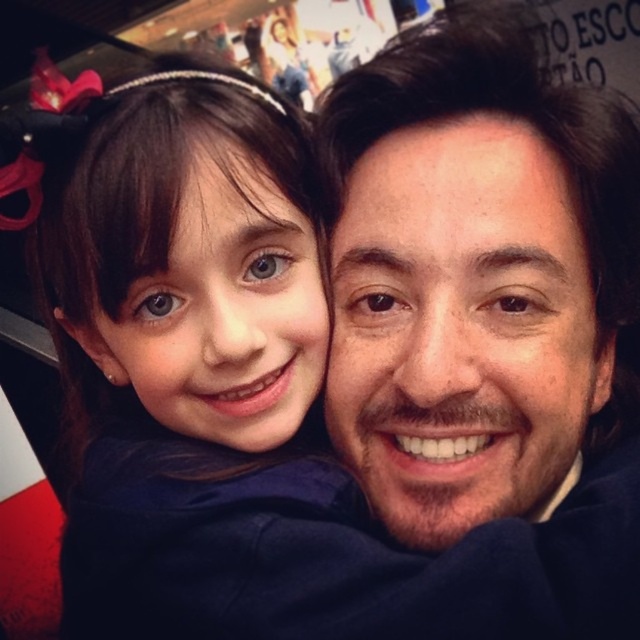
You are a fashion designer who wants to place the matte blue dress at center and the matte plastic photo frame at upper center on a mannequin. Which object should you place first to ensure proper alignment according to their positions in the original image?

The matte plastic photo frame at upper center should be placed first since the matte blue dress at center is positioned to its right, meaning the frame needs to be in place before aligning the dress accordingly.

You are taking a photo of two people in the scene. The first person is at point (125, 454) and the second is at point (275, 68). Which of these two points is closer to the camera?

Point (125, 454) is closer to the camera than point (275, 68).